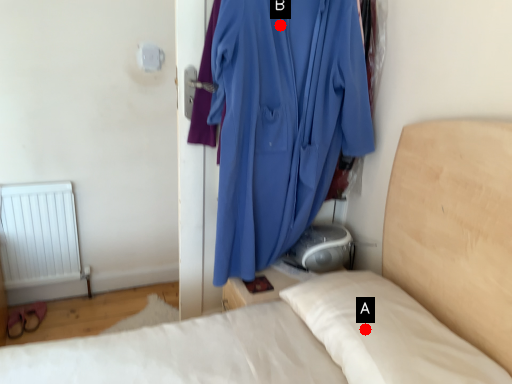
Question: Two points are circled on the image, labeled by A and B beside each circle. Which of the following is the closest to the observer?

Choices:
 (A) A is closer
 (B) B is closer

Answer: (A)